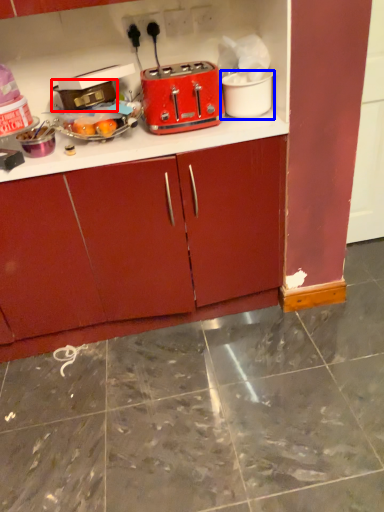
Question: Which point is closer to the camera, appliance (highlighted by a red box) or appliance (highlighted by a blue box)?

Choices:
 (A) appliance
 (B) appliance

Answer: (A)